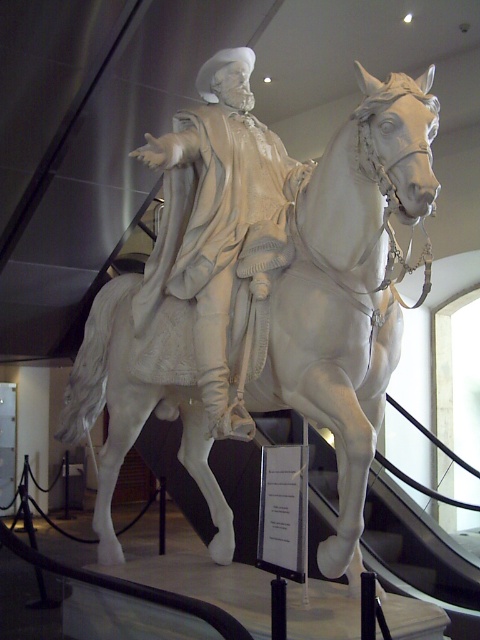
You are an art conservator assessing the space requirements for transporting the statue. The transport crate must accommodate the widest part of either the white marble horse at center or the white marble statue at center. Which object determines the minimum required width of the crate?

The white marble horse at center might be wider than the white marble statue at center, so the crate must be at least as wide as the white marble horse at center to ensure proper accommodation.

You are an art student standing in front of the equestrian statue. You notice two white marble objects at the center of the scene. Which one is positioned closer to you, the white marble horse at center or the white marble statue at center?

The white marble horse at center is closer to the viewer than the white marble statue at center.